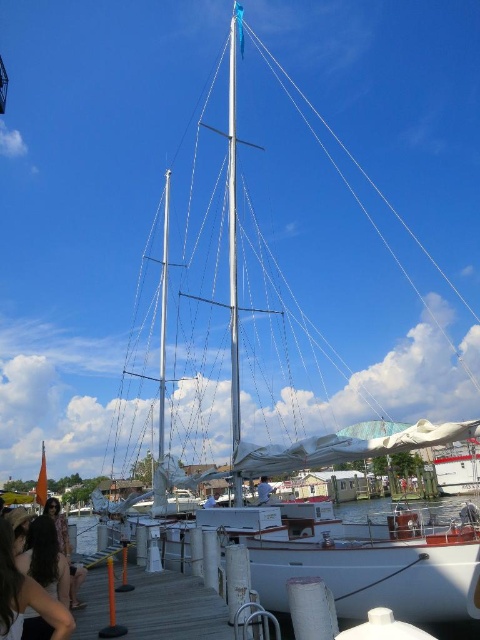
Is white fabric sail at center further to the viewer compared to blue fabric sail at center?

No, white fabric sail at center is closer to the viewer.

Does white fabric sail at center have a greater height compared to blue fabric sail at center?

Correct, white fabric sail at center is much taller as blue fabric sail at center.

The image size is (480, 640). I want to click on white fabric sail at center, so click(264, 490).

This screenshot has width=480, height=640. Identify the location of white fabric sail at center. (264, 490).

Which of these two, white matte sailboat at center or blue fabric sail at center, stands taller?

Standing taller between the two is blue fabric sail at center.

Between point (478, 472) and point (217, 493), which one is positioned in front?

Point (217, 493) is in front.

Identify the location of white matte sailboat at center. (457, 468).

Is polished silver mast at center above clear water at dock center?

Yes.

This screenshot has height=640, width=480. In order to click on polished silver mast at center in this screenshot , I will do `click(232, 237)`.

Image resolution: width=480 pixels, height=640 pixels. I want to click on polished silver mast at center, so click(232, 237).